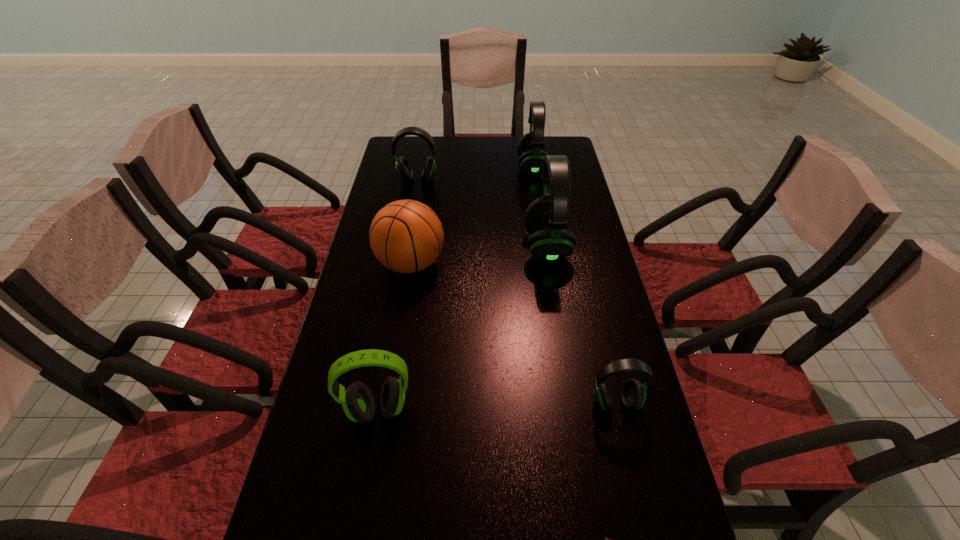
You are a GUI agent. You are given a task and a screenshot of the screen. Output one action in this format:
    pyautogui.click(x=<x>, y=<y>)
    Task: Click on the vacant point located between the second tallest object and the shortest headset
    The height and width of the screenshot is (540, 960).
    Given the screenshot: What is the action you would take?
    pyautogui.click(x=574, y=285)

Locate an element on the screen. This screenshot has height=540, width=960. object that is the sixth closest to the biggest black headset is located at coordinates (606, 539).

What are the coordinates of `object that is the fourth closest to the biggest black headset` in the screenshot? It's located at (633, 393).

Where is `the fourth closest headset to the second tallest object`? The width and height of the screenshot is (960, 540). the fourth closest headset to the second tallest object is located at coordinates (358, 403).

At what (x,y) coordinates should I click in order to perform the action: click on headset that is the fourth closest to the third farthest black headset. Please return your answer as a coordinate pair (x, y). The height and width of the screenshot is (540, 960). Looking at the image, I should click on (358, 403).

Identify which black headset is the second nearest to the second tallest headset. Please provide its 2D coordinates. Your answer should be formatted as a tuple, i.e. [(x, y)], where the tuple contains the x and y coordinates of a point satisfying the conditions above.

[(403, 168)]

Identify which black headset is located as the second nearest to the leftmost black headset. Please provide its 2D coordinates. Your answer should be formatted as a tuple, i.e. [(x, y)], where the tuple contains the x and y coordinates of a point satisfying the conditions above.

[(547, 218)]

What are the coordinates of `vacant space that satisfies the following two spatial constraints: 1. on the ear cups of the green headset; 2. on the right side of the leftmost black headset` in the screenshot? It's located at (375, 409).

The image size is (960, 540). What are the coordinates of `vacant space that satisfies the following two spatial constraints: 1. on the ear cups of the second tallest object; 2. on the ear cups of the third biggest black headset` in the screenshot? It's located at (534, 180).